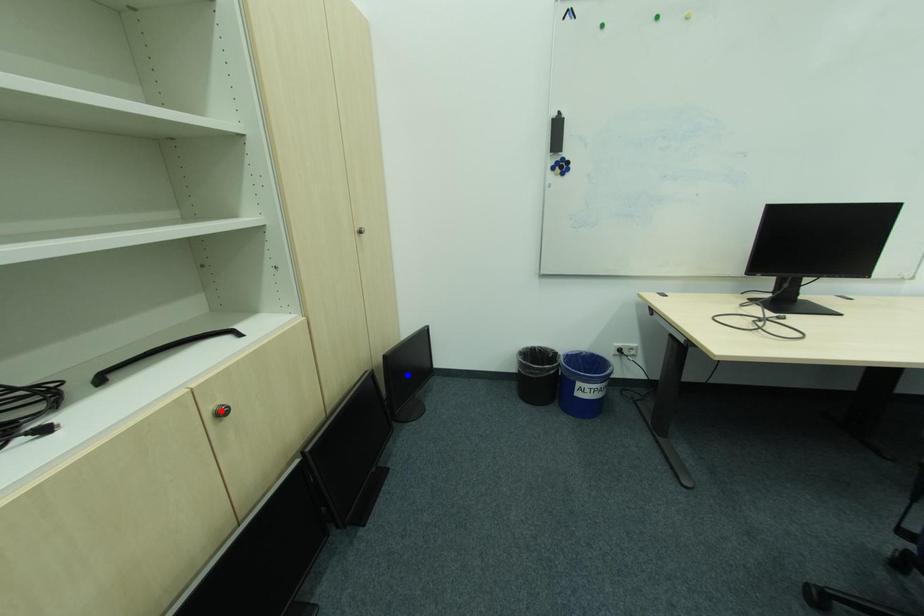
Question: Which of the two points in the image is closer to the camera?

Choices:
 (A) Blue point is closer.
 (B) Red point is closer.

Answer: (B)